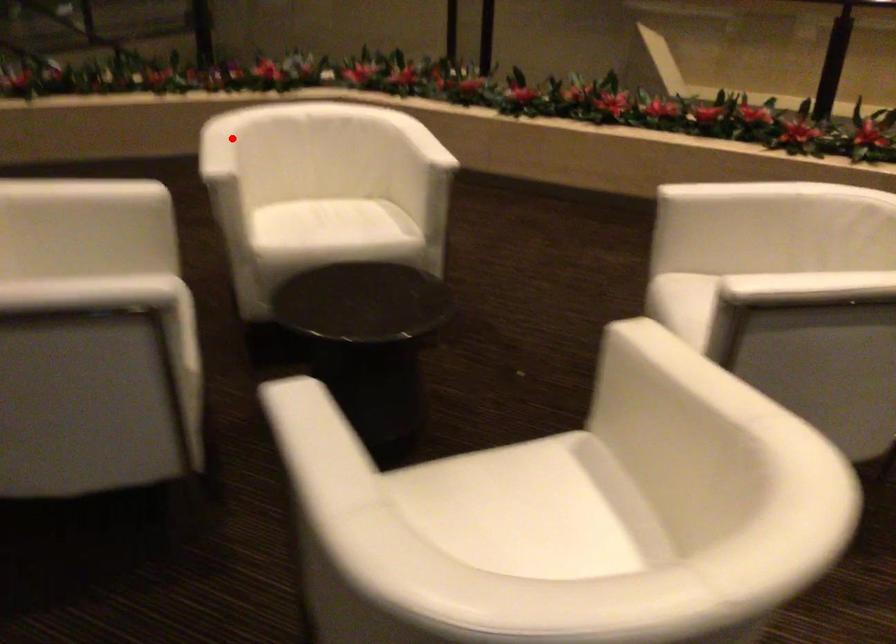
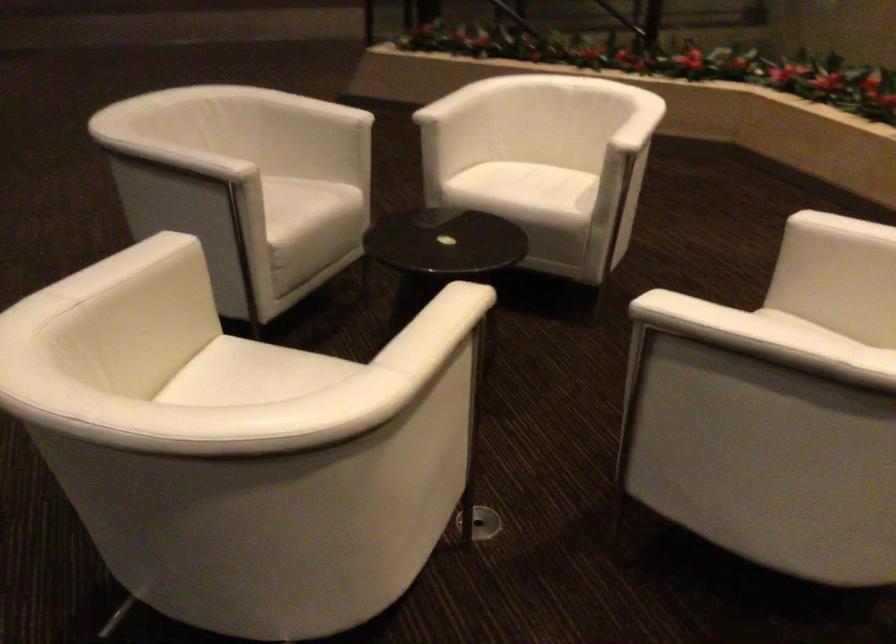
In the second image, find the point that corresponds to the highlighted location in the first image.

(469, 89)